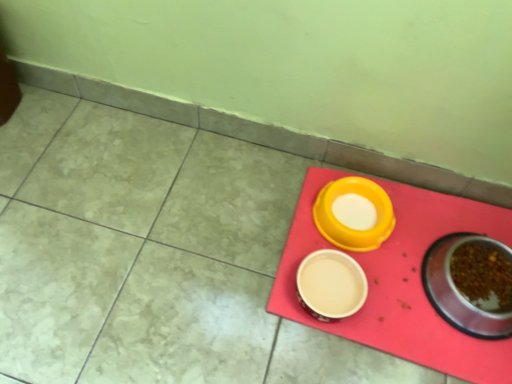
The image size is (512, 384). I want to click on vacant area situated to the left side of beige ceramic bowl at center, the first tableware in the left-to-right sequence, so click(x=239, y=284).